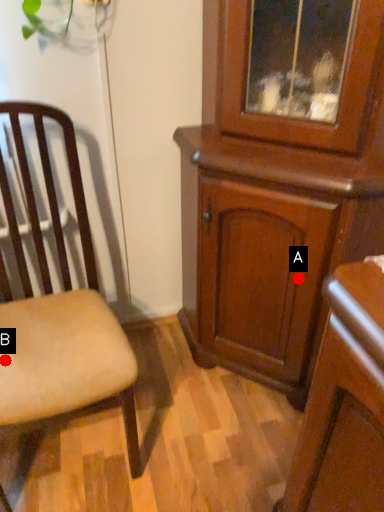
Question: Two points are circled on the image, labeled by A and B beside each circle. Which point appears closest to the camera in this image?

Choices:
 (A) A is closer
 (B) B is closer

Answer: (B)